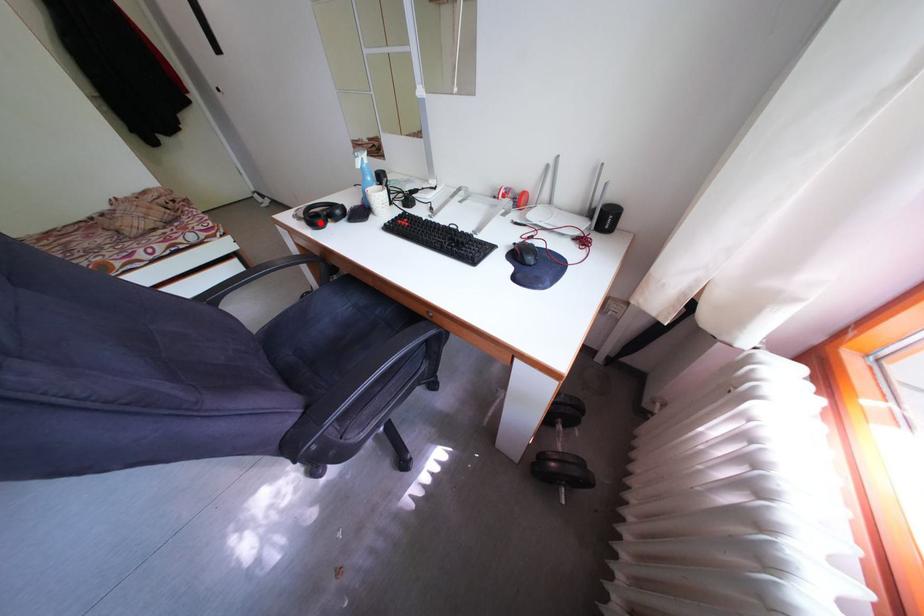
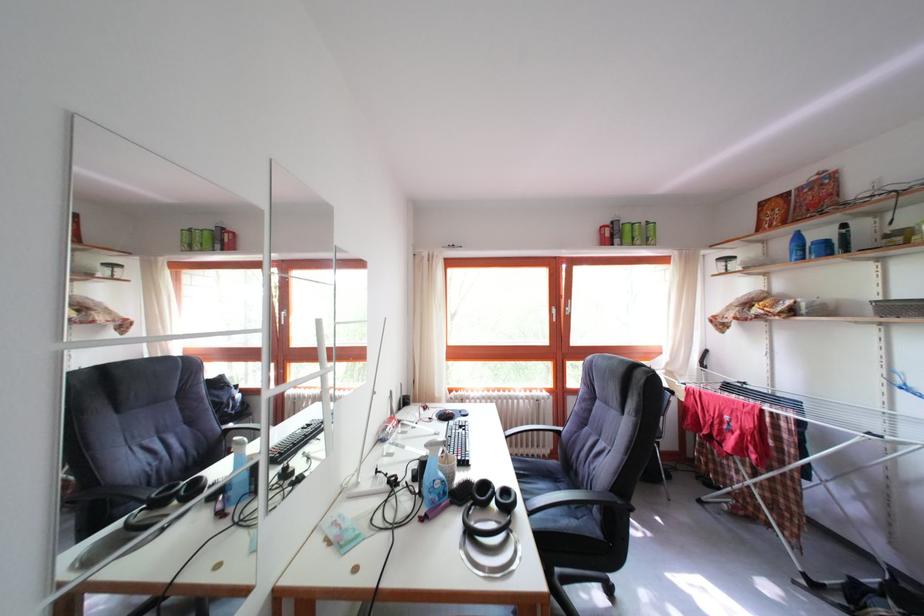
Question: I am providing you with two images of the same scene from different viewpoints. Image1 has a red point marked. In image2, the corresponding 3D location appears at what relative position? Reply with the corresponding letter.

Choices:
 (A) Closer
 (B) Farther

Answer: (A)